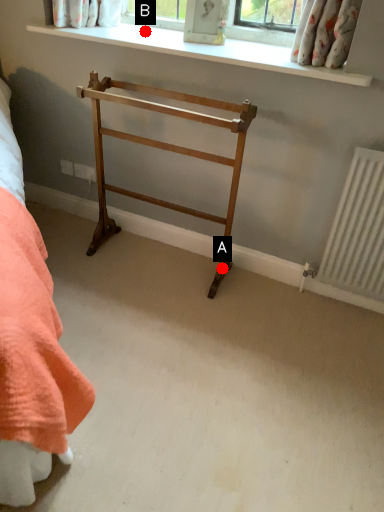
Question: Two points are circled on the image, labeled by A and B beside each circle. Which of the following is the closest to the observer?

Choices:
 (A) A is closer
 (B) B is closer

Answer: (B)